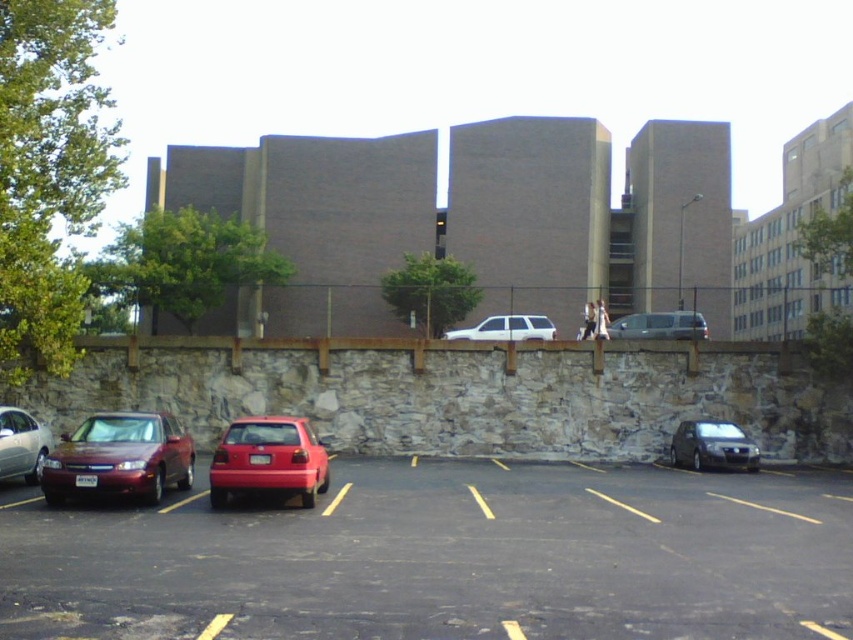
You are a delivery driver who needs to park your vehicle in the parking lot. Based on the image, where exactly is the smooth asphalt parking lot at lower center located?

The smooth asphalt parking lot at lower center is located at point (x=445, y=557).

You are standing at the point marked by coordinates (268,460) in the parking lot. What vehicle are you directly at?

The point marked by coordinates (268,460) marks the glossy red hatchback at center.

You are a driver looking for parking in the parking lot. You see the glossy red hatchback at center and the white matte suv at center. Which vehicle is closer to the ground?

The glossy red hatchback at center is located below the white matte suv at center, so it is closer to the ground.